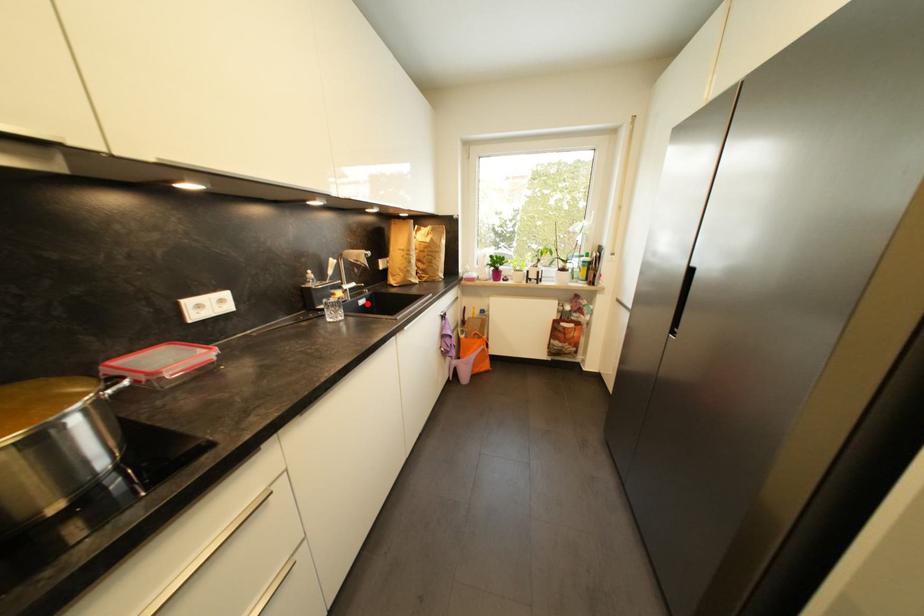
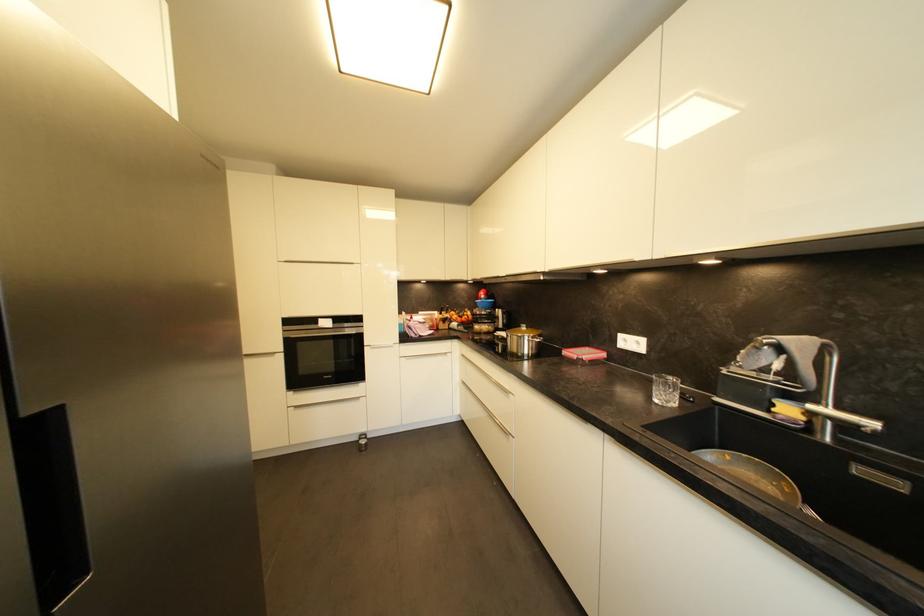
Find the pixel in the second image that matches the highlighted location in the first image.

(904, 487)